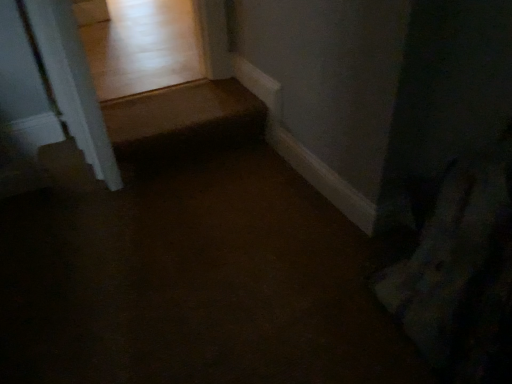
Question: From the image's perspective, would you say white glossy door frame at upper left is positioned over brown carpet at center?

Choices:
 (A) yes
 (B) no

Answer: (A)

Question: Is white glossy door frame at upper left located outside brown carpet at center?

Choices:
 (A) no
 (B) yes

Answer: (B)

Question: Is white glossy door frame at upper left taller than brown carpet at center?

Choices:
 (A) no
 (B) yes

Answer: (B)

Question: Is white glossy door frame at upper left at the left side of brown carpet at center?

Choices:
 (A) no
 (B) yes

Answer: (B)

Question: Is white glossy door frame at upper left wider than brown carpet at center?

Choices:
 (A) no
 (B) yes

Answer: (A)

Question: From a real-world perspective, is white glossy door frame at upper left positioned under brown carpet at center based on gravity?

Choices:
 (A) no
 (B) yes

Answer: (A)

Question: Is brown carpet at center smaller than white glossy door frame at upper left?

Choices:
 (A) no
 (B) yes

Answer: (A)

Question: Considering the relative sizes of brown carpet at center and white glossy door frame at upper left in the image provided, is brown carpet at center thinner than white glossy door frame at upper left?

Choices:
 (A) no
 (B) yes

Answer: (A)

Question: Is brown carpet at center positioned with its back to white glossy door frame at upper left?

Choices:
 (A) yes
 (B) no

Answer: (B)

Question: Does brown carpet at center have a greater width compared to white glossy door frame at upper left?

Choices:
 (A) yes
 (B) no

Answer: (A)

Question: Is brown carpet at center outside of white glossy door frame at upper left?

Choices:
 (A) no
 (B) yes

Answer: (B)

Question: Is brown carpet at center bigger than white glossy door frame at upper left?

Choices:
 (A) yes
 (B) no

Answer: (A)

Question: Which is correct: brown carpet at center is inside white glossy door frame at upper left, or outside of it?

Choices:
 (A) inside
 (B) outside

Answer: (B)